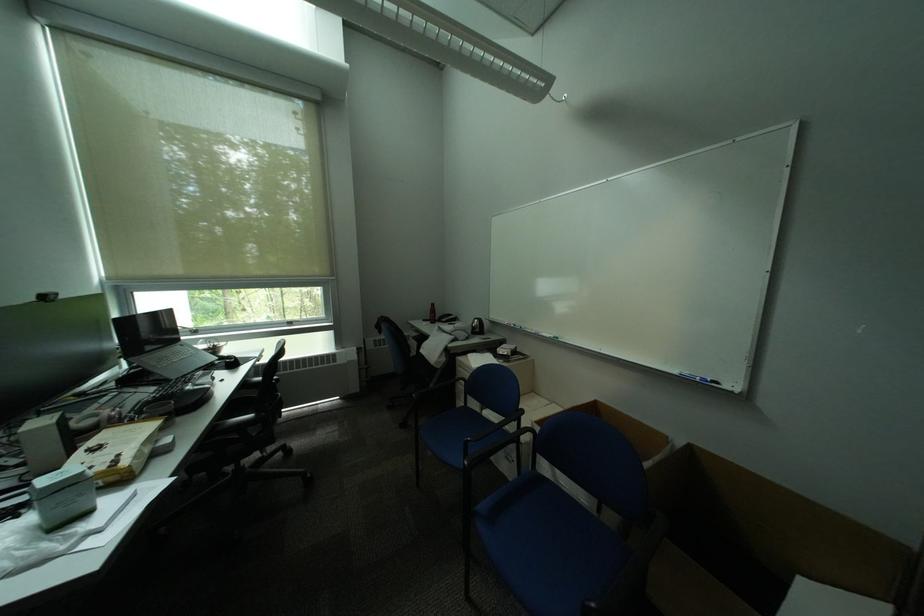
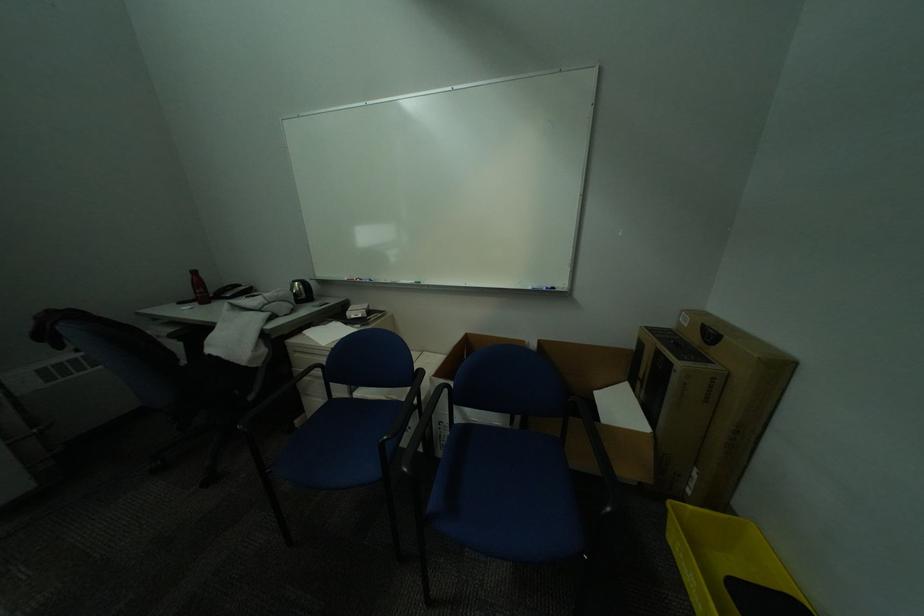
The point at (484, 330) is marked in the first image. Where is the corresponding point in the second image?

(307, 296)